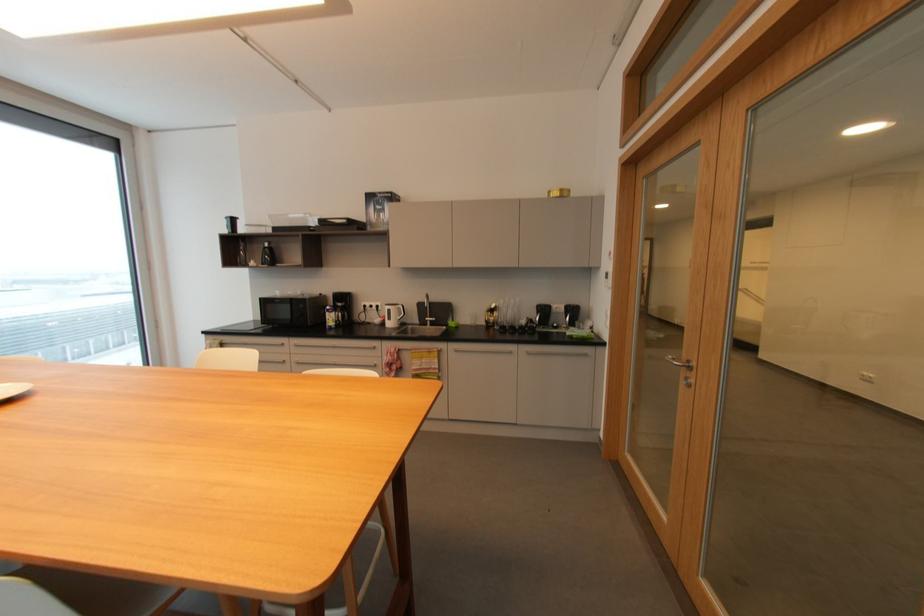
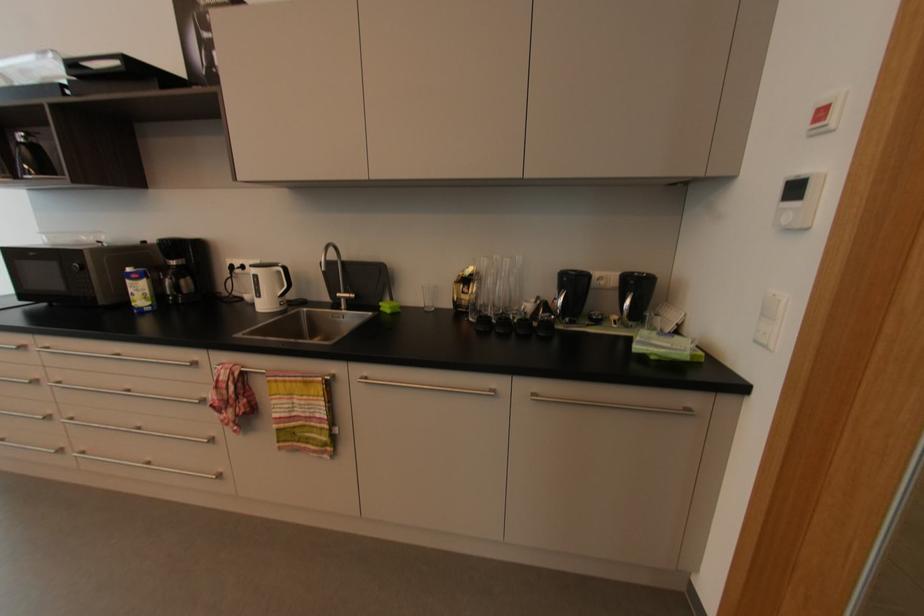
In the second image, find the point that corresponds to pixel 507 325 in the first image.

(493, 313)